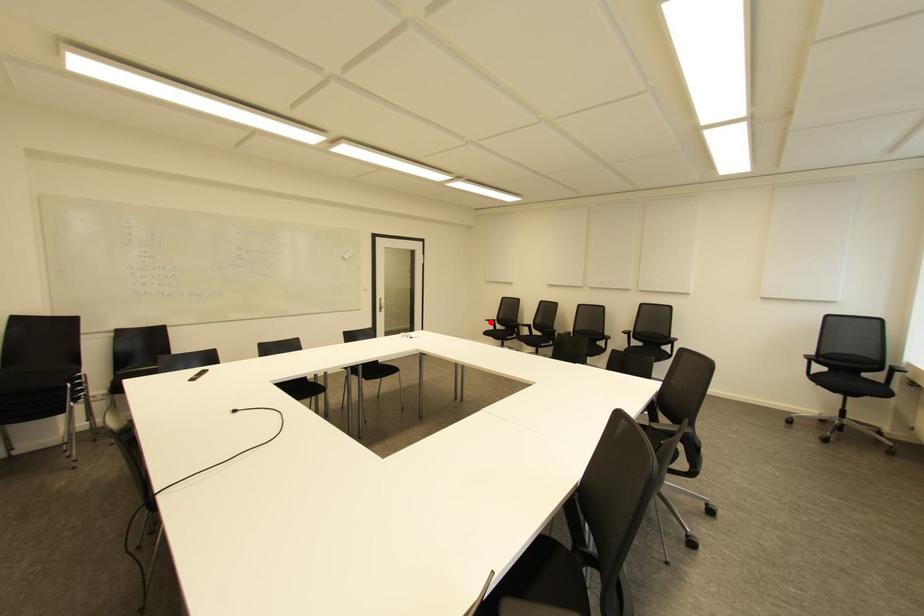
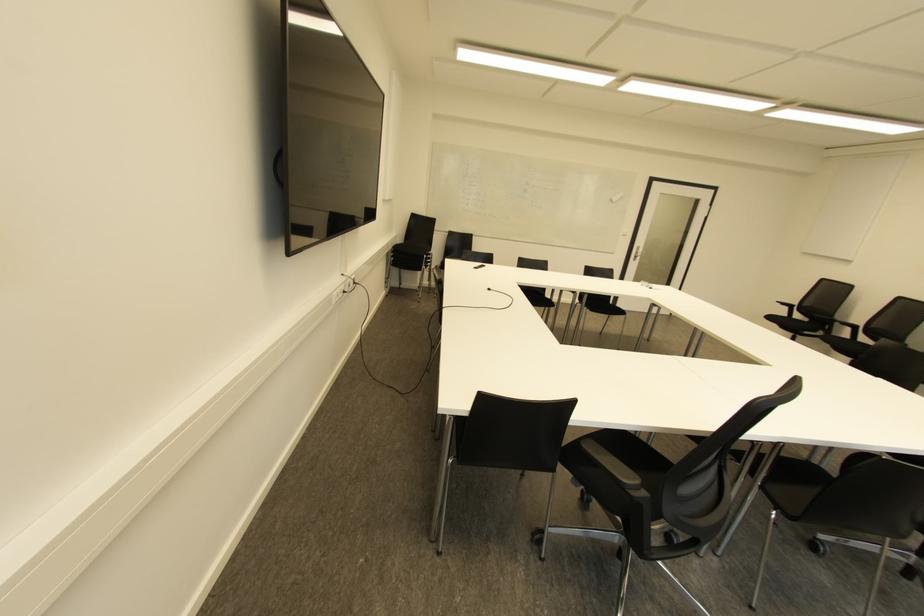
Question: I am providing you with two images of the same scene from different viewpoints. A red point is marked on the first image. At the location where the point appears in image 1, is it still visible in image 2?

Choices:
 (A) Yes
 (B) No

Answer: (A)